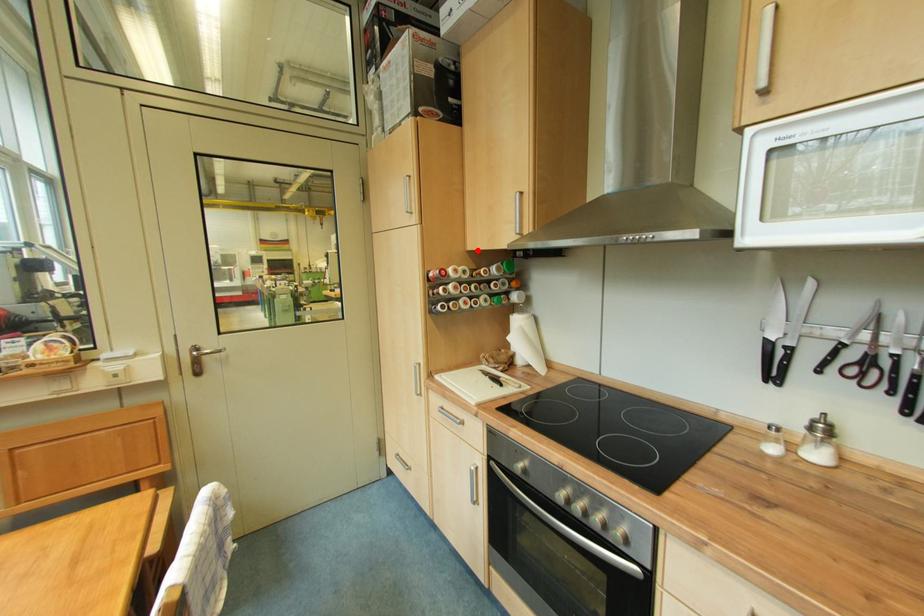
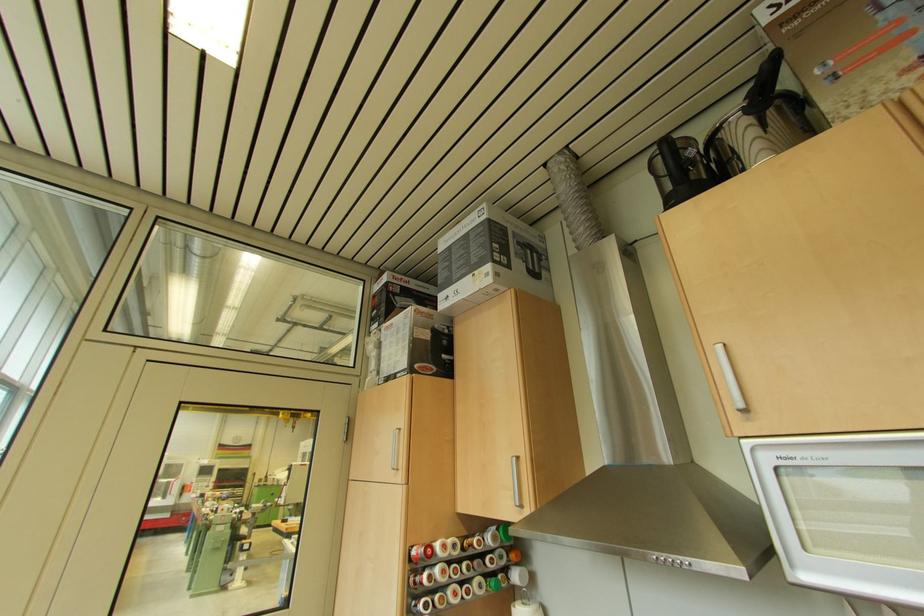
Where in the second image is the point corresponding to the highlighted location from the first image?

(468, 513)